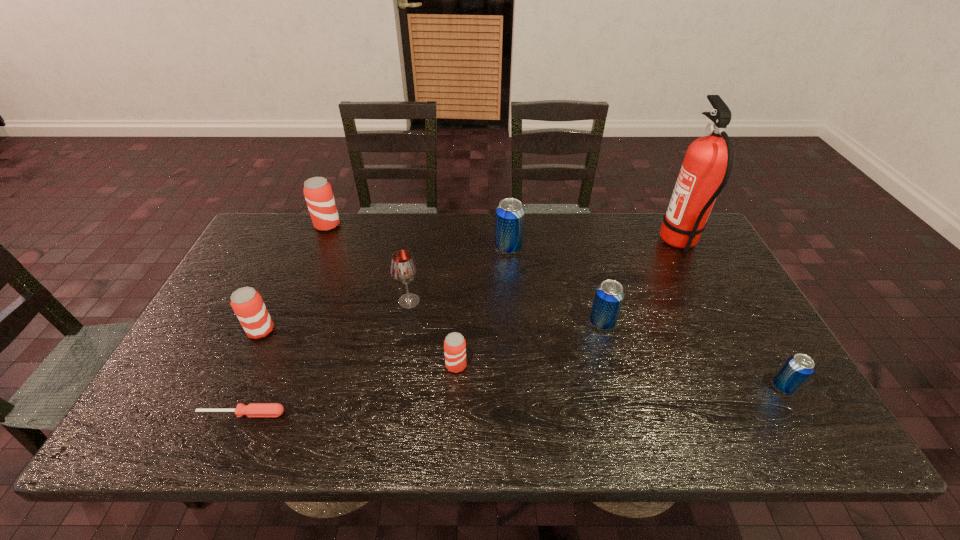
This screenshot has height=540, width=960. I want to click on free area in between the smallest orange beer can and the sixth nearest object, so click(x=433, y=333).

Identify which object is the second closest to the nearest object. Please provide its 2D coordinates. Your answer should be formatted as a tuple, i.e. [(x, y)], where the tuple contains the x and y coordinates of a point satisfying the conditions above.

[(403, 269)]

Where is `object that is the third closest to the nearest orange beer can`? This screenshot has width=960, height=540. object that is the third closest to the nearest orange beer can is located at coordinates (253, 409).

I want to click on beer can that is the fifth closest to the smallest orange beer can, so click(797, 369).

Identify which beer can is the third nearest to the biggest orange beer can. Please provide its 2D coordinates. Your answer should be formatted as a tuple, i.e. [(x, y)], where the tuple contains the x and y coordinates of a point satisfying the conditions above.

[(454, 345)]

Locate which orange beer can ranks third in proximity to the sixth nearest object. Please provide its 2D coordinates. Your answer should be formatted as a tuple, i.e. [(x, y)], where the tuple contains the x and y coordinates of a point satisfying the conditions above.

[(318, 193)]

Locate which orange beer can is the closest to the fifth object from left to right. Please provide its 2D coordinates. Your answer should be formatted as a tuple, i.e. [(x, y)], where the tuple contains the x and y coordinates of a point satisfying the conditions above.

[(246, 302)]

Where is `blue beer can that is the second closest to the screwdriver`? The width and height of the screenshot is (960, 540). blue beer can that is the second closest to the screwdriver is located at coordinates point(609,295).

Identify the location of the second closest blue beer can to the rightmost blue beer can. The width and height of the screenshot is (960, 540). (509, 225).

Where is `vacant space that satisfies the following two spatial constraints: 1. on the front side of the nearest blue beer can; 2. on the left side of the biggest orange beer can`? Image resolution: width=960 pixels, height=540 pixels. vacant space that satisfies the following two spatial constraints: 1. on the front side of the nearest blue beer can; 2. on the left side of the biggest orange beer can is located at coordinates (x=259, y=387).